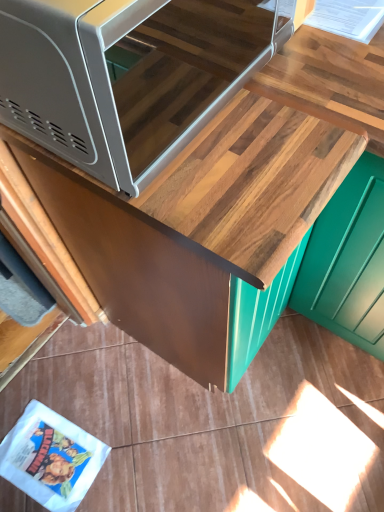
Where is `vacant space to the right of matte gray microwave at upper left`? This screenshot has width=384, height=512. vacant space to the right of matte gray microwave at upper left is located at coordinates (317, 92).